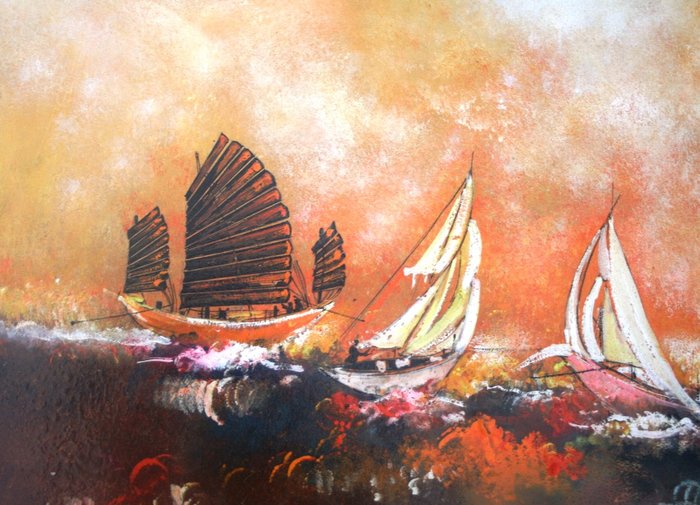
Locate an element on the screen. The height and width of the screenshot is (505, 700). painting is located at coordinates (372, 173).